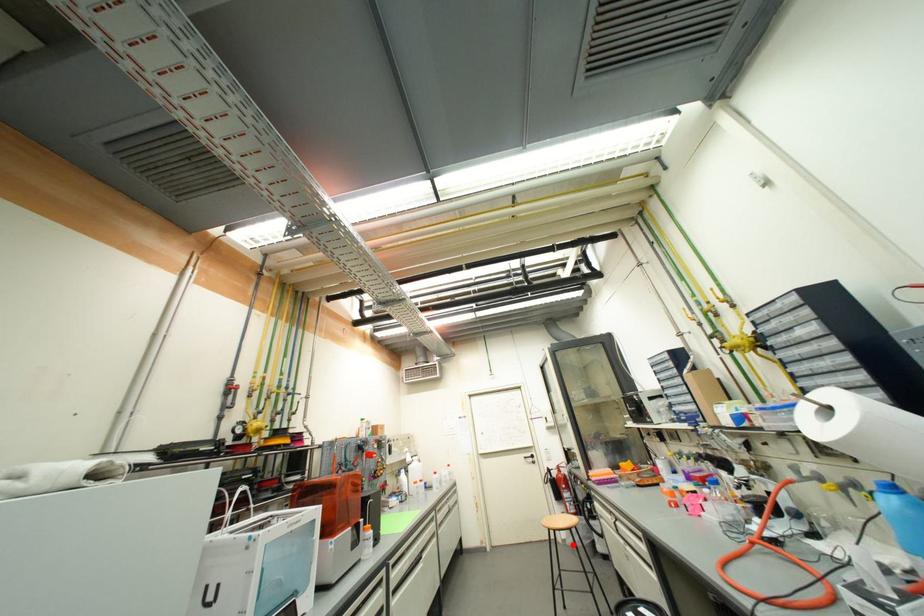
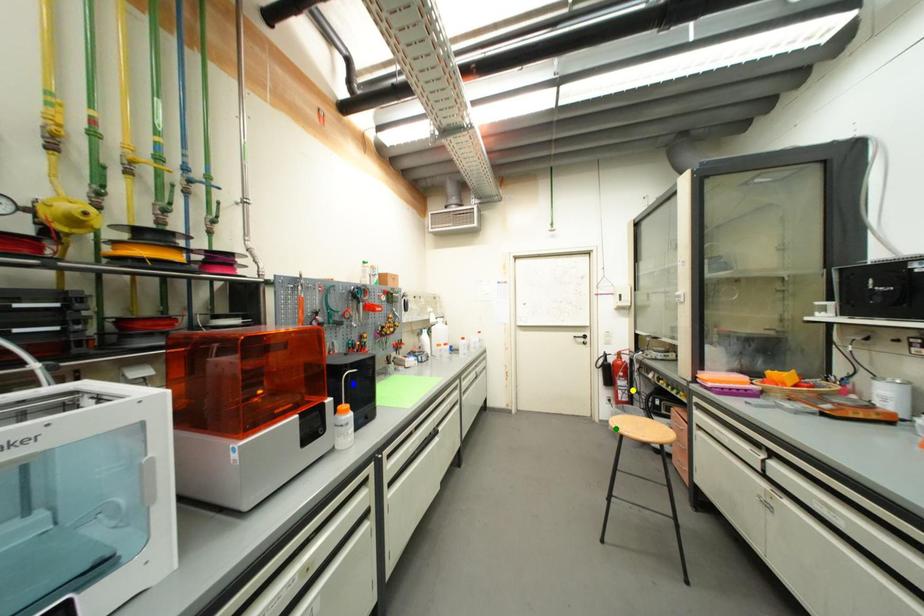
Question: I am providing you with two images of the same scene from different viewpoints. A red point is marked on the first image. You are given multiple points on the second image. Which point in image 2 is actually the same real-world point as the red point in image 1?

Choices:
 (A) yellow point
 (B) green point
 (C) blue point

Answer: (B)